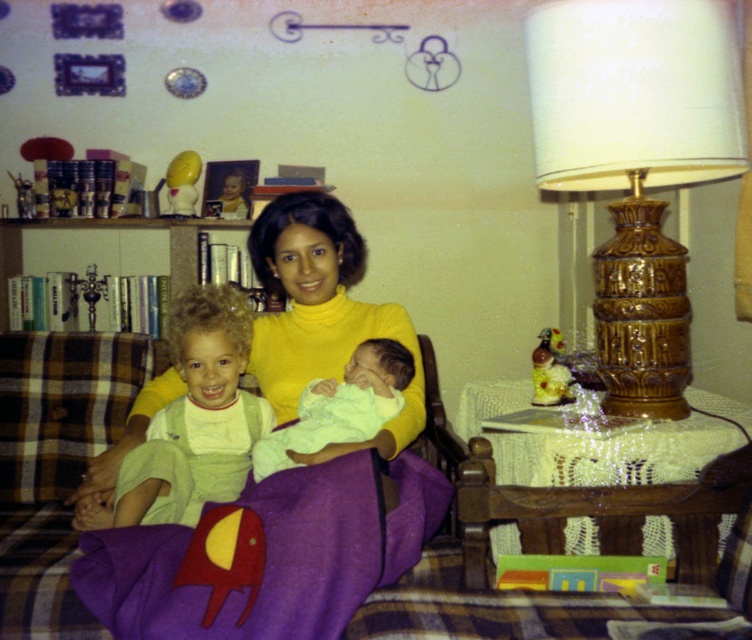
Question: Among these points, which one is nearest to the camera?

Choices:
 (A) (290, 378)
 (B) (544, 184)
 (C) (302, 497)
 (D) (262, 440)

Answer: (C)

Question: Does yellow turtleneck sweater at center have a greater width compared to light green fabric baby at center?

Choices:
 (A) yes
 (B) no

Answer: (A)

Question: Is gold textured lamp at right wider than purple fleece blanket at lower left?

Choices:
 (A) yes
 (B) no

Answer: (B)

Question: Does gold textured lamp at right appear over yellow turtleneck sweater at center?

Choices:
 (A) yes
 (B) no

Answer: (A)

Question: Which object is the farthest from the light green fabric at center?

Choices:
 (A) gold textured lamp at right
 (B) yellow turtleneck sweater at center
 (C) purple fleece blanket at lower left
 (D) light green fabric baby at center

Answer: (A)

Question: Which point is farther to the camera?

Choices:
 (A) gold textured lamp at right
 (B) yellow turtleneck sweater at center

Answer: (A)